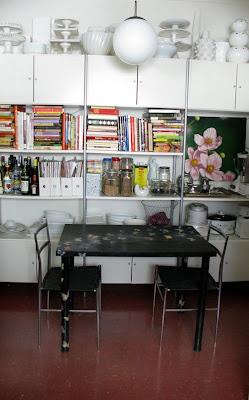
At what (x,y) coordinates should I click in order to perform the action: click on bowls stored on shelfs. Please return your answer as a coordinate pair (x, y). Looking at the image, I should click on (120, 215), (51, 214), (134, 219), (98, 44), (170, 46).